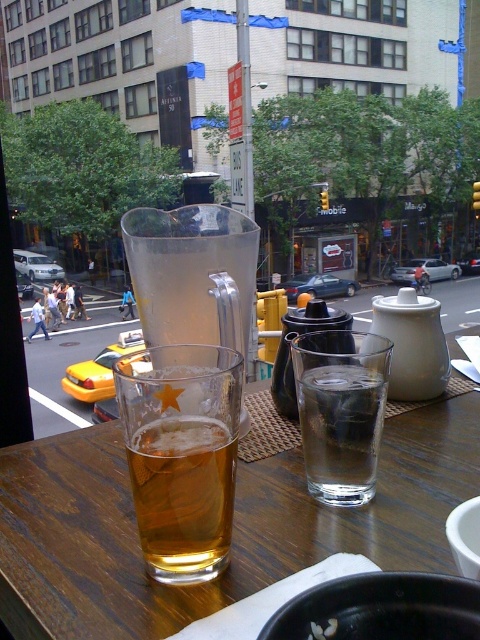
Question: Is wooden table at center smaller than clear glass beer at center?

Choices:
 (A) no
 (B) yes

Answer: (A)

Question: Which point is closer to the camera taking this photo?

Choices:
 (A) (328, 625)
 (B) (135, 330)
 (C) (165, 429)

Answer: (A)

Question: Which of the following is the farthest from the observer?

Choices:
 (A) (310, 634)
 (B) (348, 369)
 (C) (204, 529)
 (D) (109, 586)

Answer: (B)

Question: Which point is farther to the camera?

Choices:
 (A) (159, 428)
 (B) (440, 483)
 (C) (327, 412)
 (D) (98, 362)

Answer: (D)

Question: Does wooden table at center have a larger size compared to translucent glass beer at center?

Choices:
 (A) yes
 (B) no

Answer: (A)

Question: In this image, where is wooden table at center located relative to translucent glass beer at center?

Choices:
 (A) right
 (B) left

Answer: (A)